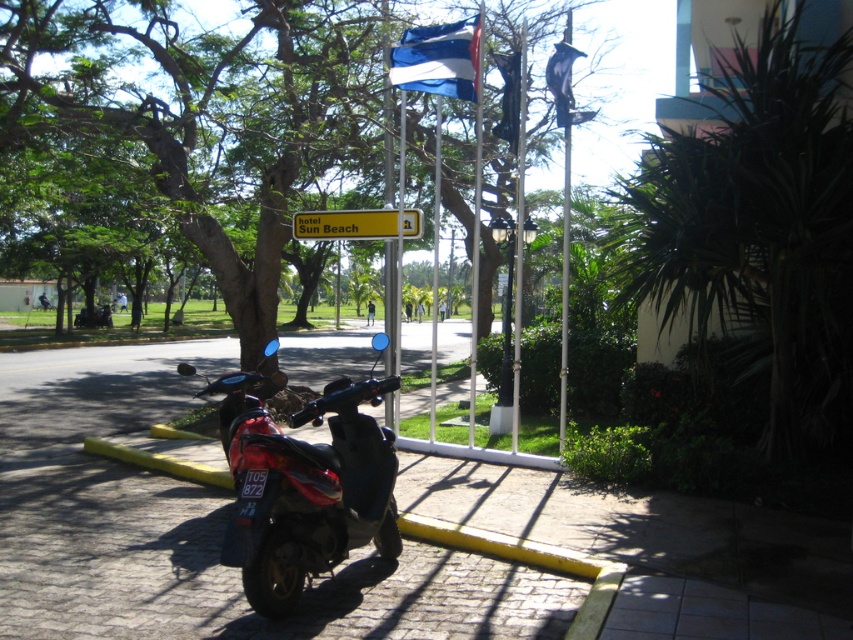
Question: Is yellow plastic sign at center thinner than metallic flagpole at center?

Choices:
 (A) no
 (B) yes

Answer: (A)

Question: Which point is closer to the camera?

Choices:
 (A) (633, 236)
 (B) (505, 116)

Answer: (A)

Question: Which of these objects is positioned farthest from the yellow plastic sign at center?

Choices:
 (A) green leafy tree at center
 (B) blue fabric flag at upper center

Answer: (A)

Question: Is shiny red motorcycle at center wider than blue and white fabric flag at upper center?

Choices:
 (A) yes
 (B) no

Answer: (B)

Question: Which point is farther from the camera taking this photo?

Choices:
 (A) (511, 145)
 (B) (450, 593)

Answer: (A)

Question: Is the position of green leafy tree at center less distant than that of green leafy tree at upper right?

Choices:
 (A) no
 (B) yes

Answer: (A)